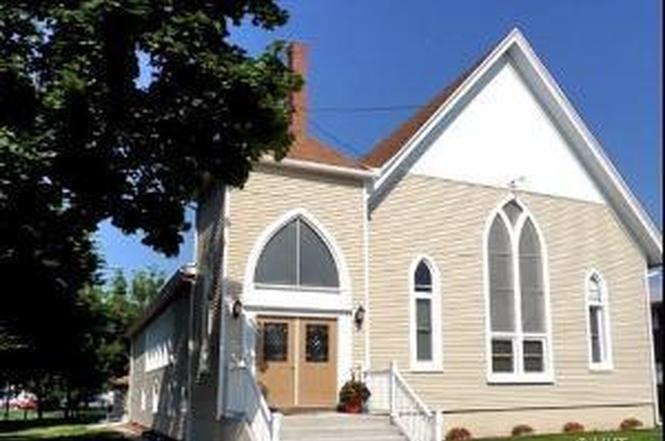
Identify the location of door. point(303,342).